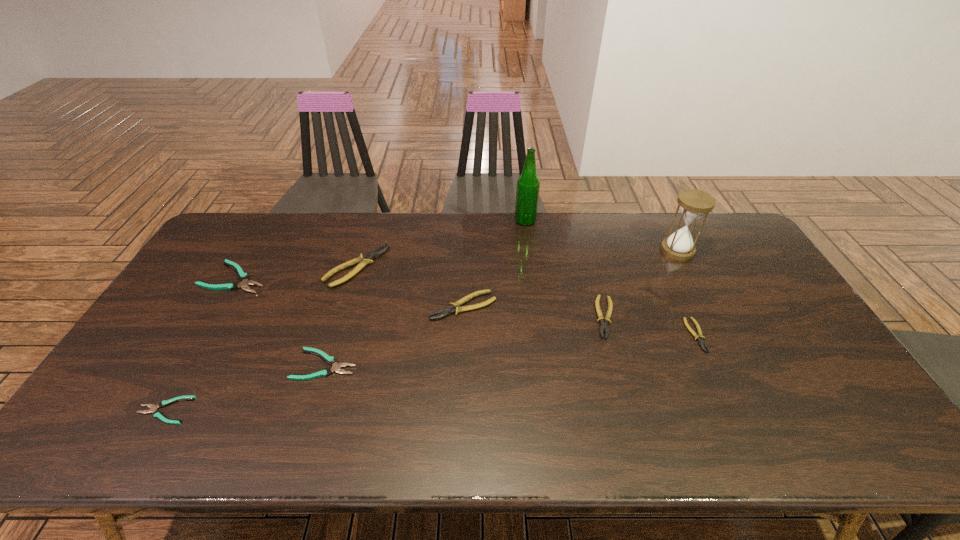
Where is `the third biggest yellow pliers`? the third biggest yellow pliers is located at coordinates (x=603, y=325).

The height and width of the screenshot is (540, 960). Identify the location of the second farthest teal pliers. (336, 367).

The height and width of the screenshot is (540, 960). In order to click on the rightmost teal pliers in this screenshot , I will do `click(336, 367)`.

The height and width of the screenshot is (540, 960). I want to click on the rightmost pliers, so click(699, 337).

Locate an element on the screen. The width and height of the screenshot is (960, 540). the rightmost yellow pliers is located at coordinates (699, 337).

At what (x,y) coordinates should I click in order to perform the action: click on the smallest teal pliers. Please return your answer as a coordinate pair (x, y). Looking at the image, I should click on (153, 408).

Locate an element on the screen. Image resolution: width=960 pixels, height=540 pixels. the nearest object is located at coordinates (153, 408).

This screenshot has width=960, height=540. Find the location of `blank space located on the label of the fourth object from right to left`. blank space located on the label of the fourth object from right to left is located at coordinates click(476, 221).

You are a GUI agent. You are given a task and a screenshot of the screen. Output one action in this format:
    pyautogui.click(x=<x>, y=<y>)
    Task: Click on the vacant space situated on the label of the fourth object from right to left
    This screenshot has width=960, height=540.
    Given the screenshot: What is the action you would take?
    pyautogui.click(x=468, y=221)

You are a GUI agent. You are given a task and a screenshot of the screen. Output one action in this format:
    pyautogui.click(x=<x>, y=<y>)
    Task: Click on the blank space located 0.160m on the label of the fourth object from right to left
    
    Given the screenshot: What is the action you would take?
    pyautogui.click(x=471, y=221)